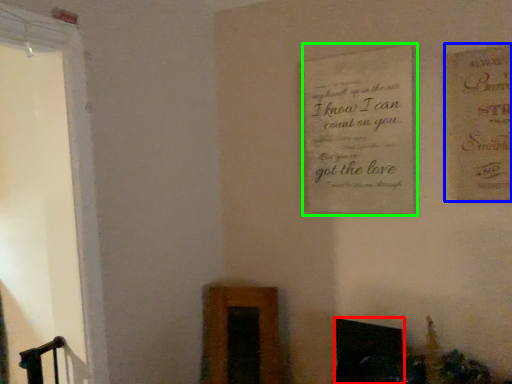
Question: Which object is the farthest from fireplace (highlighted by a red box)? Choose among these: postcard (highlighted by a blue box) or plaque (highlighted by a green box).

Choices:
 (A) postcard
 (B) plaque

Answer: (A)